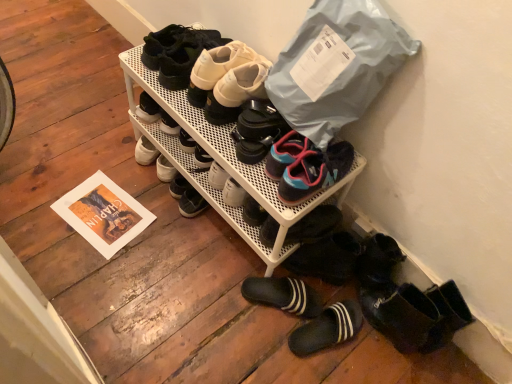
You are a GUI agent. You are given a task and a screenshot of the screen. Output one action in this format:
    pyautogui.click(x=<x>, y=<y>)
    Task: Click on the vacant space to the left of white mesh shoe rack at center, which is counted as the fourth footwear, starting from the top
    
    Given the screenshot: What is the action you would take?
    (113, 190)